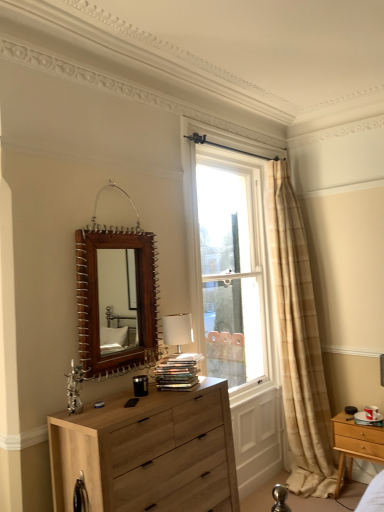
Question: Is light wood/texture nightstand at lower right in front of or behind natural wood chest of drawers at lower left in the image?

Choices:
 (A) behind
 (B) front

Answer: (A)

Question: Considering the positions of point (339, 426) and point (150, 441), is point (339, 426) closer or farther from the camera than point (150, 441)?

Choices:
 (A) farther
 (B) closer

Answer: (A)

Question: Which object is the farthest from the light wood/texture nightstand at lower right?

Choices:
 (A) beige plaid curtain at right
 (B) brown wooden mirror at upper center
 (C) natural wood chest of drawers at lower left
 (D) clear glass window at center

Answer: (D)

Question: Which object is the farthest from the brown wooden mirror at upper center?

Choices:
 (A) light wood/texture nightstand at lower right
 (B) natural wood chest of drawers at lower left
 (C) clear glass window at center
 (D) beige plaid curtain at right

Answer: (C)